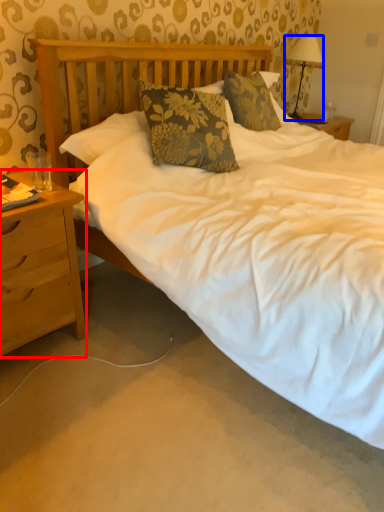
Question: Which point is closer to the camera, nightstand (highlighted by a red box) or lamp (highlighted by a blue box)?

Choices:
 (A) nightstand
 (B) lamp

Answer: (A)